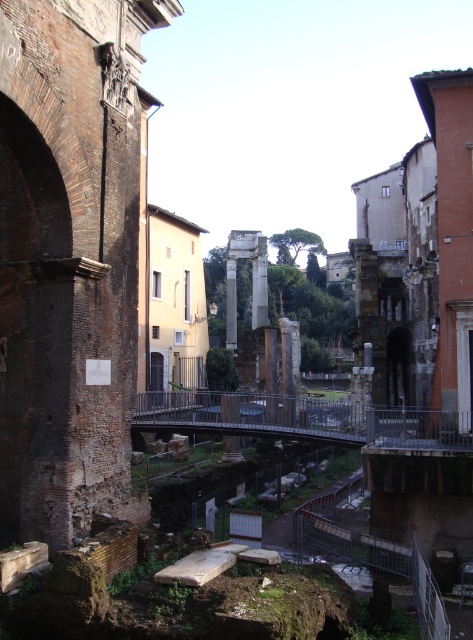
You are standing in the ancient urban landscape and want to take a photo of both the brick wall at left and the white marble pillar at center. Which object should you focus on first to ensure both are in the frame?

You should focus on the brick wall at left first since it is closer to the viewer than the white marble pillar at center, ensuring both are in the frame by adjusting the camera angle accordingly.

You are an architect visiting the site and want to compare the visual impact of the brick wall at left and the white marble pillar at center. Which object takes up more space in the image?

The white marble pillar at center occupies more space than the brick wall at left, making it more visually prominent in the image.

You are an archaeologist examining the ancient urban landscape. You notice the brick wall at left and the white marble pillar at center. Which structure is positioned lower in the scene?

The brick wall at left is positioned below the white marble pillar at center, so it is lower in the scene.